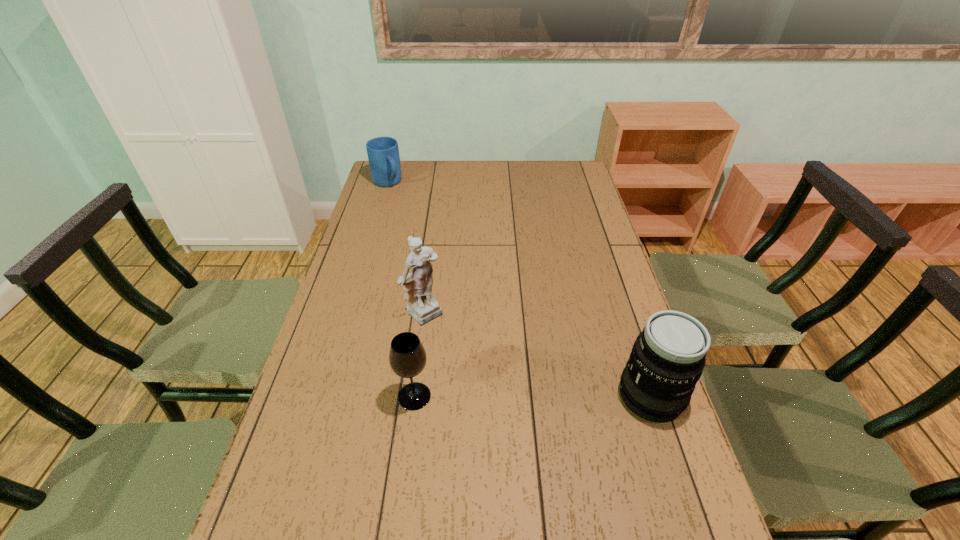
Locate an element on the screen. free location at the left edge of the desktop is located at coordinates (352, 269).

Locate an element on the screen. vacant space at the right edge is located at coordinates (611, 382).

Locate an element on the screen. The height and width of the screenshot is (540, 960). vacant region at the far left corner of the desktop is located at coordinates (408, 170).

You are a GUI agent. You are given a task and a screenshot of the screen. Output one action in this format:
    pyautogui.click(x=<x>, y=<y>)
    Task: Click on the free spot at the near left corner of the desktop
    
    Given the screenshot: What is the action you would take?
    pyautogui.click(x=301, y=524)

Where is `free space between the shortest object and the telephoto lens`? free space between the shortest object and the telephoto lens is located at coordinates (518, 289).

Image resolution: width=960 pixels, height=540 pixels. I want to click on vacant space that's between the shortest object and the figurine, so click(407, 248).

Where is `free space that is in between the second farthest object and the shortest object`? This screenshot has height=540, width=960. free space that is in between the second farthest object and the shortest object is located at coordinates (407, 248).

The image size is (960, 540). I want to click on empty location between the figurine and the shortest object, so click(x=407, y=248).

Where is `vacant area that lies between the shortest object and the rightmost object`? The width and height of the screenshot is (960, 540). vacant area that lies between the shortest object and the rightmost object is located at coordinates (518, 289).

Where is `vacant space in between the telephoto lens and the wineglass`? vacant space in between the telephoto lens and the wineglass is located at coordinates (533, 396).